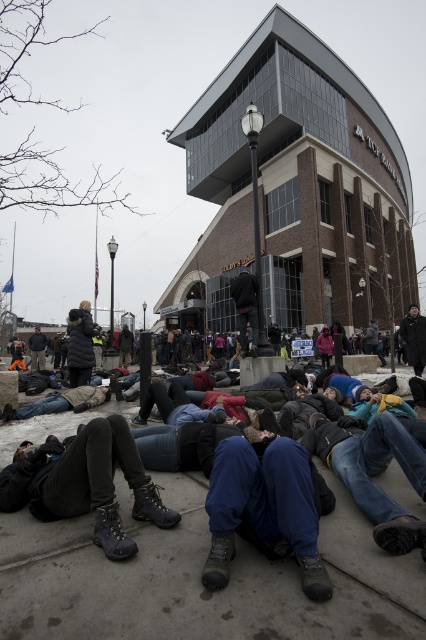
Question: Which of the following is the closest to the observer?

Choices:
 (A) blue jeans at lower center
 (B) gray concrete pavement at center
 (C) dark gray leather boots at lower left
 (D) black puffy coat at center

Answer: (B)

Question: Can you confirm if gray concrete pavement at center is smaller than dark gray leather boots at lower left?

Choices:
 (A) no
 (B) yes

Answer: (B)

Question: Does dark gray leather boots at lower left have a lesser width compared to blue jeans at lower center?

Choices:
 (A) no
 (B) yes

Answer: (A)

Question: Does blue suede boots at center appear under black puffy coat at center?

Choices:
 (A) no
 (B) yes

Answer: (B)

Question: Which object is positioned closest to the black puffy coat at center?

Choices:
 (A) gray concrete pavement at center
 (B) dark gray leather boots at lower left
 (C) blue suede boots at center
 (D) blue jeans at lower center

Answer: (B)

Question: Which object is the farthest from the dark gray leather boots at lower left?

Choices:
 (A) gray concrete pavement at center
 (B) blue suede boots at center
 (C) black puffy coat at center
 (D) blue jeans at lower center

Answer: (C)